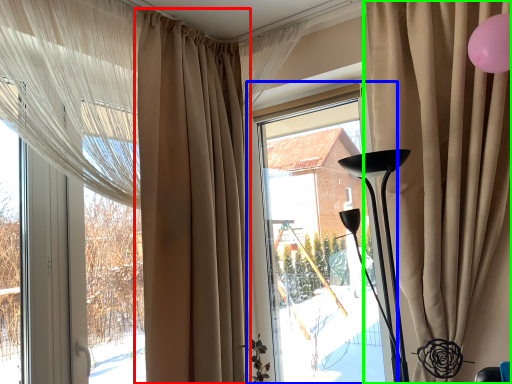
Question: Based on their relative distances, which object is nearer to curtain (highlighted by a red box)? Choose from window (highlighted by a blue box) and curtain (highlighted by a green box).

Choices:
 (A) window
 (B) curtain

Answer: (A)